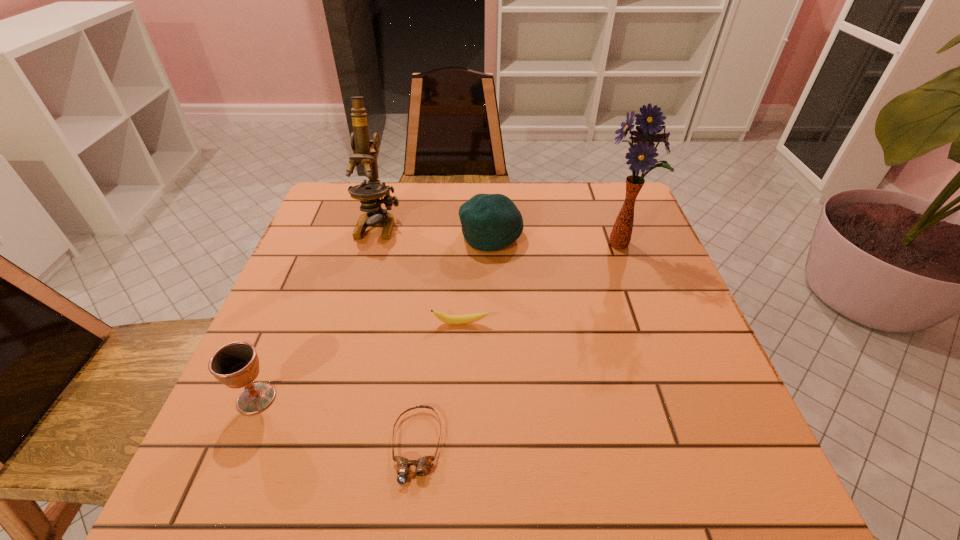
Locate an element on the screen. Image resolution: width=960 pixels, height=540 pixels. free space that satisfies the following two spatial constraints: 1. on the back side of the leftmost object; 2. on the right side of the microscope is located at coordinates (329, 224).